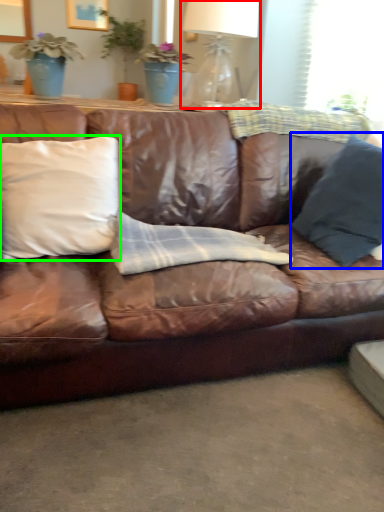
Question: Considering the real-world distances, which object is closest to table lamp (highlighted by a red box)? pillow (highlighted by a blue box) or pillow (highlighted by a green box).

Choices:
 (A) pillow
 (B) pillow

Answer: (A)